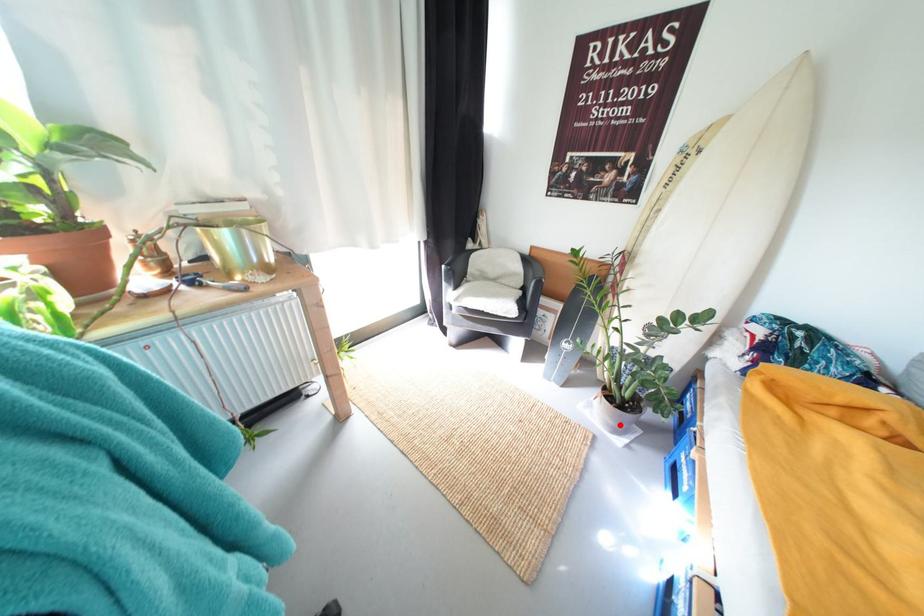
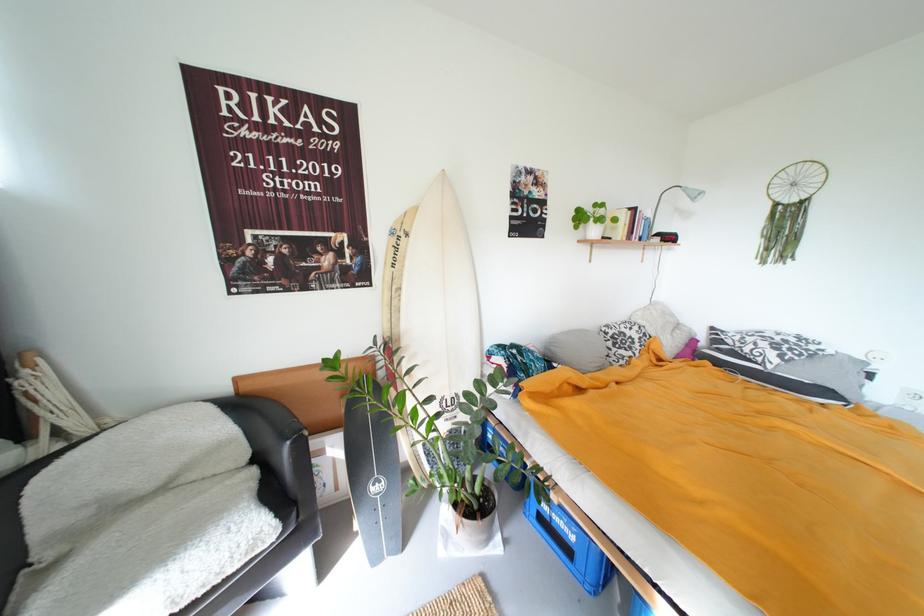
The point at the highlighted location is marked in the first image. Where is the corresponding point in the second image?

(492, 539)